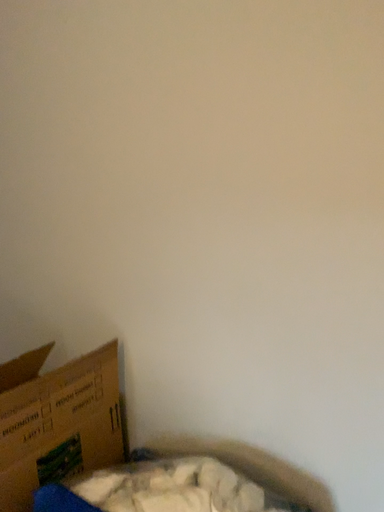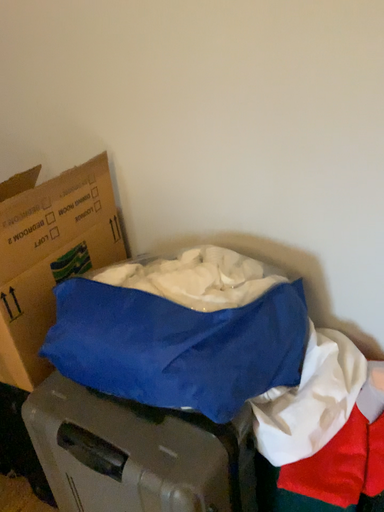
Question: Which way did the camera rotate in the video?

Choices:
 (A) rotated upward
 (B) rotated downward

Answer: (B)